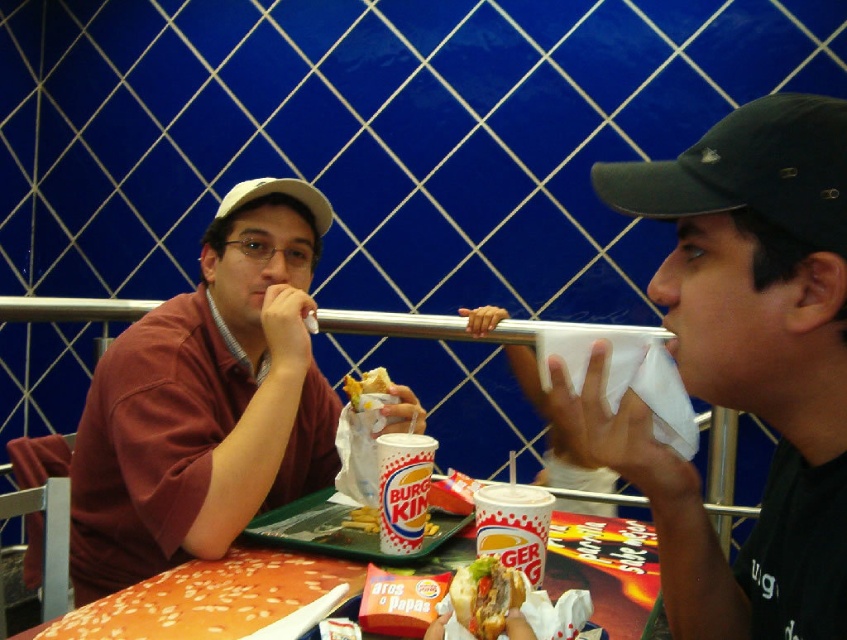
Question: Can you confirm if black matte baseball cap at right is positioned to the right of white paper cup at center?

Choices:
 (A) no
 (B) yes

Answer: (B)

Question: Based on their relative distances, which object is nearer to the black matte baseball cap at right?

Choices:
 (A) smooth orange hamburger bun at lower left
 (B) golden crispy chicken at center
 (C) white paper cup at center

Answer: (C)

Question: Can you confirm if black matte cup at right is bigger than white matte baseball cap at upper left?

Choices:
 (A) yes
 (B) no

Answer: (A)

Question: Estimate the real-world distances between objects in this image. Which object is closer to the white matte baseball cap at upper left?

Choices:
 (A) smooth orange hamburger bun at lower left
 (B) black matte baseball cap at right
 (C) orange textured table at center
 (D) black matte cup at right

Answer: (A)

Question: Is white paper cup at center to the left of golden crispy chicken at center from the viewer's perspective?

Choices:
 (A) no
 (B) yes

Answer: (A)

Question: Based on their relative distances, which object is farther from the white paper cup at center?

Choices:
 (A) white matte baseball cap at upper left
 (B) black matte cup at right
 (C) matte brown shirt at center

Answer: (A)